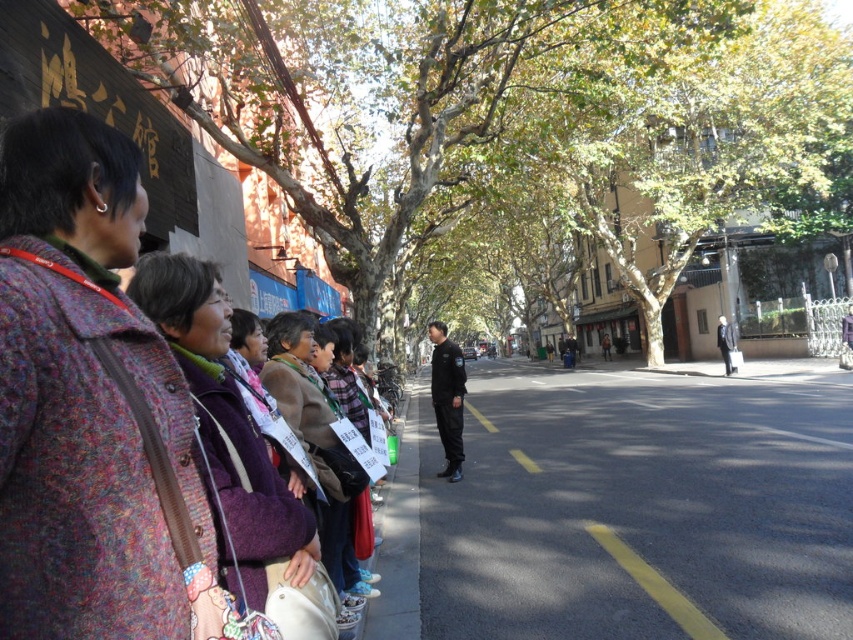
You are a delivery person who needs to pass through the street to reach the dark blue uniform at center. There is a green leafy tree at upper center blocking your path. Can you walk around it without going out of the street? The street is 6 meters wide.

The green leafy tree at upper center is 5.82 meters from the dark blue uniform at center. Since the street is 6 meters wide, you can walk around the tree while staying within the street as the distance between them allows enough space.

You are a delivery person who needs to park your van near the gray concrete curb at lower center. The van is 2 meters wide. Can you park the van next to the green leafy tree at upper center without overlapping them?

The green leafy tree at upper center is wider than the gray concrete curb at lower center. Since the van is 2 meters wide, you need to ensure there is enough space between the tree and the curb. However, since the tree is wider, it might block part of the parking space. Therefore, parking the van next to the gray concrete curb at lower center without overlapping may not be possible due to the tree width.